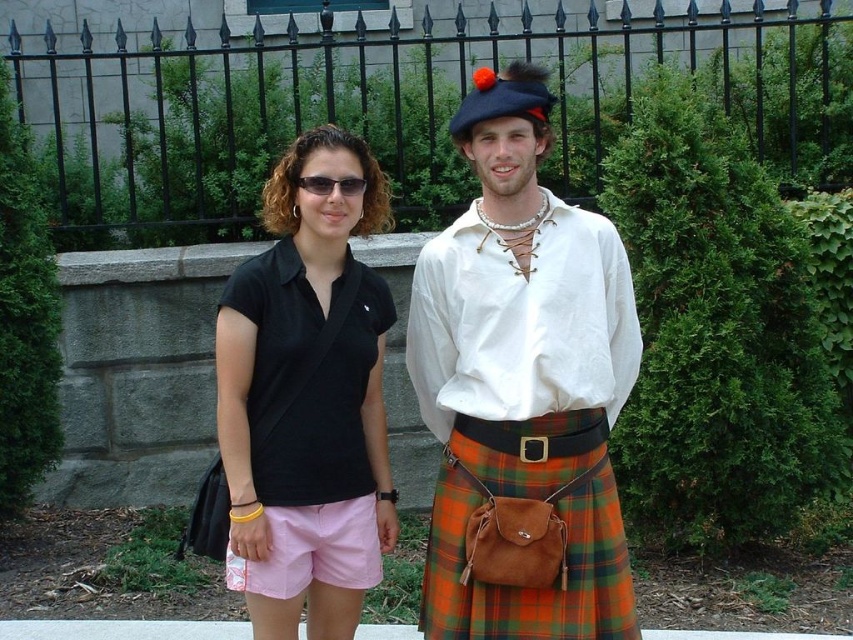
Does black matte shirt at center have a larger size compared to matte black sunglasses at center?

Indeed, black matte shirt at center has a larger size compared to matte black sunglasses at center.

Which is in front, point (349, 413) or point (354, 193)?

Point (354, 193)

You are a GUI agent. You are given a task and a screenshot of the screen. Output one action in this format:
    pyautogui.click(x=<x>, y=<y>)
    Task: Click on the black matte shirt at center
    
    Given the screenshot: What is the action you would take?
    pyautogui.click(x=306, y=401)

Who is lower down, black matte shirt at center or plaid wool kilt at center?

plaid wool kilt at center

Can you confirm if black matte shirt at center is positioned to the right of plaid wool kilt at center?

No, black matte shirt at center is not to the right of plaid wool kilt at center.

Find the location of a particular element. This screenshot has width=853, height=640. black matte shirt at center is located at coordinates [306, 401].

What are the coordinates of `black matte shirt at center` in the screenshot? It's located at (306, 401).

Does black matte shirt at center lie in front of pink cotton shorts at center?

Yes, black matte shirt at center is in front of pink cotton shorts at center.

Based on the photo, does black matte shirt at center have a larger size compared to pink cotton shorts at center?

Yes, black matte shirt at center is bigger than pink cotton shorts at center.

This screenshot has height=640, width=853. Find the location of `black matte shirt at center`. black matte shirt at center is located at coordinates (306, 401).